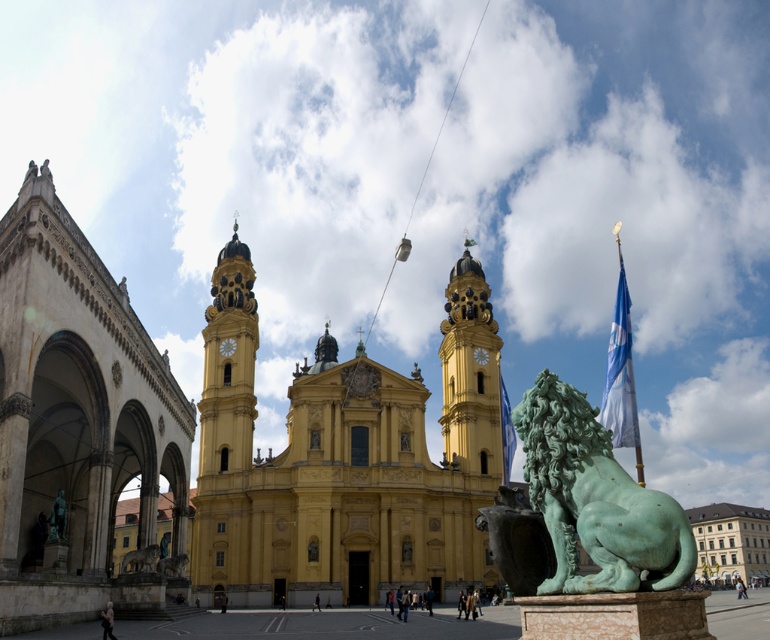
Based on the scene description, what are the coordinates of the yellow stone church at center?

The yellow stone church at center is located at coordinates (x=343, y=460).

You are a photographer planning to take a photo of the yellow stone church at center and the green patina lion at lower right. Based on their sizes, which object would likely occupy more space in the photo frame?

The yellow stone church at center might occupy more space in the photo frame since it is wider than the green patina lion at lower right according to the description.

You are standing in front of the yellow stone church at center and want to take a photo of the green patina lion at lower right. Which object should you move closer to in order to capture both in the same frame?

You should move closer to the yellow stone church at center because it is closer to you than the green patina lion at lower right, allowing both to be in the frame when positioned correctly.